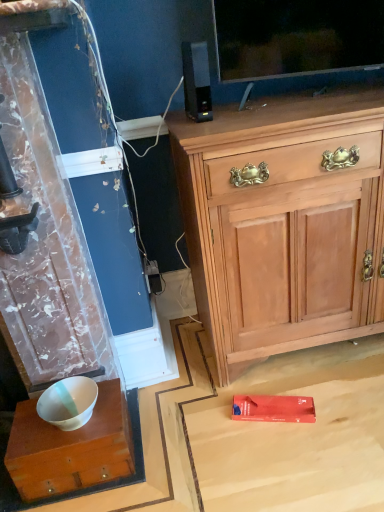
Identify the location of free point above white glossy wood desk at lower left (from a real-world perspective). (68, 420).